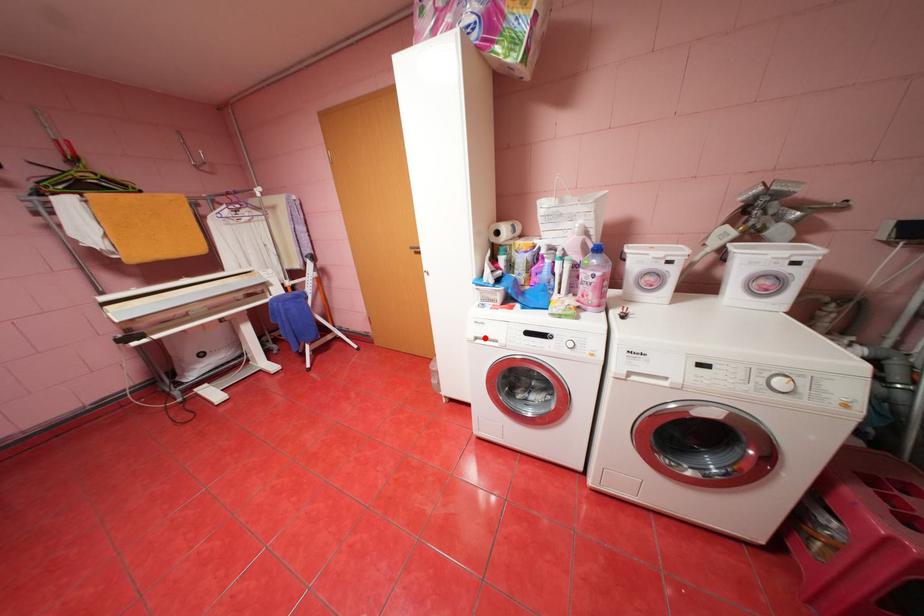
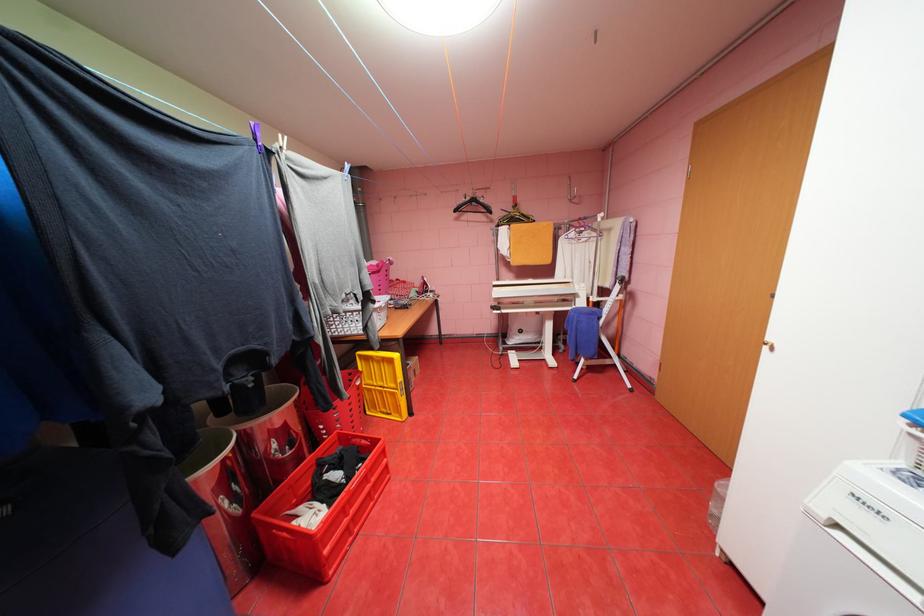
In the second image, find the point that corresponds to the highlighted location in the first image.

(845, 525)